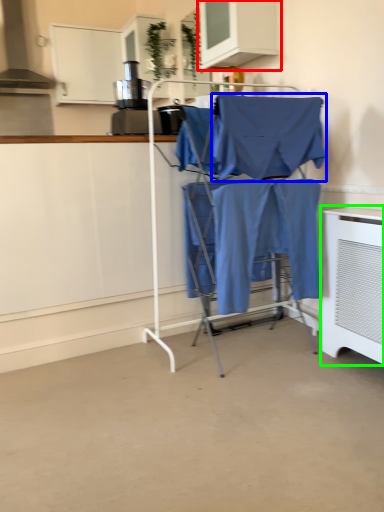
Question: Which is nearer to the cabinetry (highlighted by a red box)? fabric (highlighted by a blue box) or home appliance (highlighted by a green box).

Choices:
 (A) fabric
 (B) home appliance

Answer: (A)